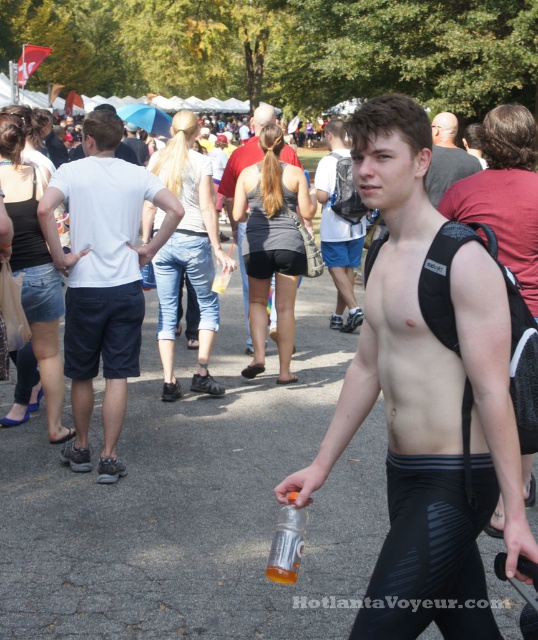
Where is `white cotton t-shirt at center`? This screenshot has width=538, height=640. white cotton t-shirt at center is located at coordinates (102, 278).

Is white cotton t-shirt at center wider than smooth bald head at center?

No.

Which is behind, point (116, 164) or point (447, 145)?

The point (447, 145) is more distant.

Image resolution: width=538 pixels, height=640 pixels. In order to click on white cotton t-shirt at center in this screenshot , I will do (102, 278).

Can you confirm if white cotton t-shirt at center is bigger than shiny black backpack at upper right?

Indeed, white cotton t-shirt at center has a larger size compared to shiny black backpack at upper right.

Image resolution: width=538 pixels, height=640 pixels. I want to click on white cotton t-shirt at center, so click(102, 278).

How much distance is there between black matte tank top at center and white cotton t-shirt at center?

8.87 feet

Identify the location of black matte tank top at center. (426, 401).